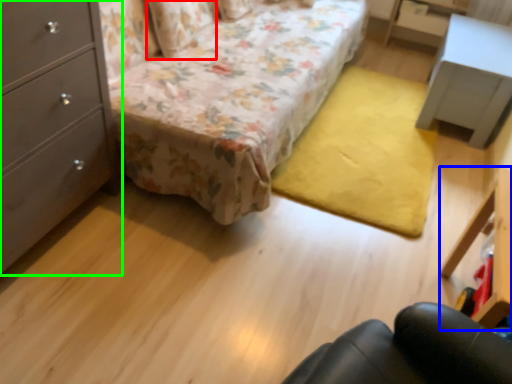
Question: Which object is positioned closest to pillow (highlighted by a red box)? Select from vanity (highlighted by a blue box) and chest of drawers (highlighted by a green box).

Choices:
 (A) vanity
 (B) chest of drawers

Answer: (B)